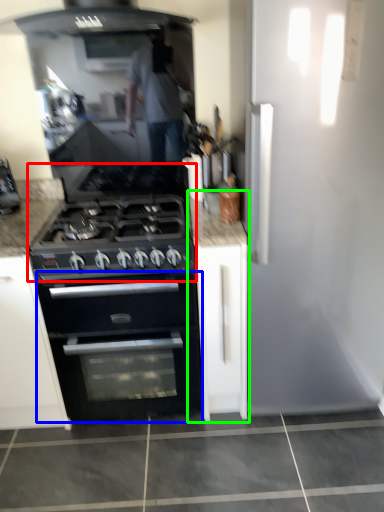
Question: Which object is the closest to the gas stove (highlighted by a red box)? Choose among these: oven (highlighted by a blue box) or cabinetry (highlighted by a green box).

Choices:
 (A) oven
 (B) cabinetry

Answer: (B)